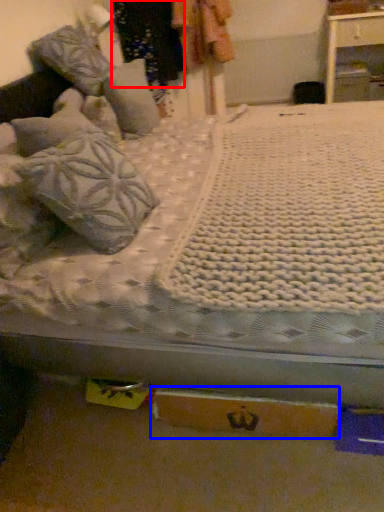
Question: Which object is further to the camera taking this photo, clothing (highlighted by a red box) or cardboard box (highlighted by a blue box)?

Choices:
 (A) clothing
 (B) cardboard box

Answer: (A)